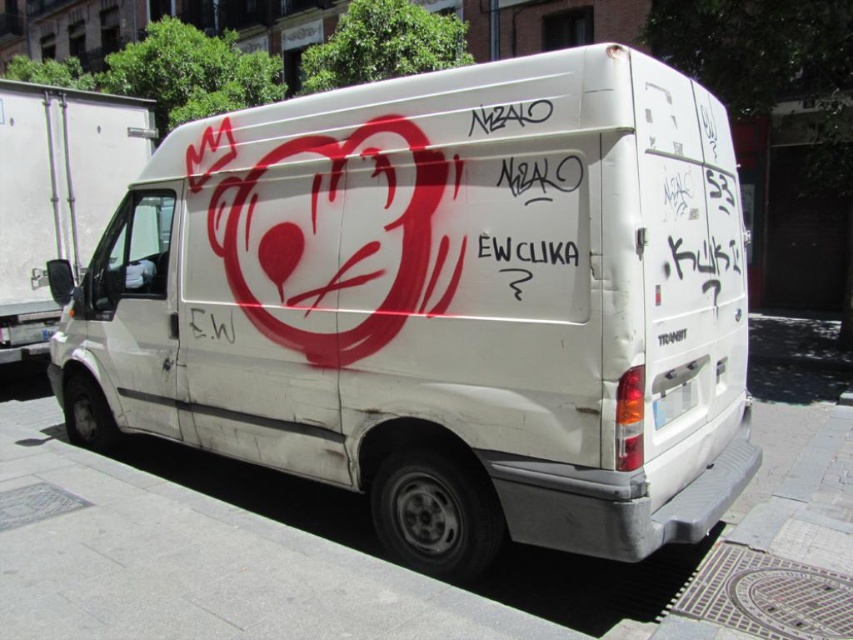
You are a photographer standing in front of the white matte van at center. You want to take a photo of it from a distance that allows you to capture the entire van without zooming. Considering the van is 3.06 meters away from you, what is the minimum distance you should step back to ensure the entire van fits in your camera frame?

The white matte van at center is 3.06 meters away from the camera. To capture the entire van without zooming, you should step back at least 3.06 meters to ensure the entire van fits in the camera frame.

You are a pedestrian standing on the sidewalk and see the white matte van at center and the white matte van at left. Which van is closer to you?

The white matte van at center is closer to you because it is in front of the white matte van at left.